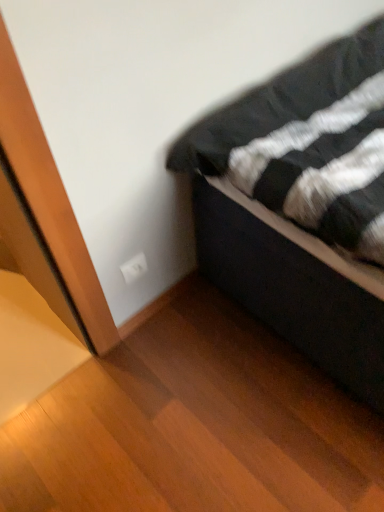
Describe the element at coordinates (134, 268) in the screenshot. I see `white plastic electric outlet at lower left` at that location.

The image size is (384, 512). What are the coordinates of `white plastic electric outlet at lower left` in the screenshot? It's located at (134, 268).

Identify the location of white plastic electric outlet at lower left. (134, 268).